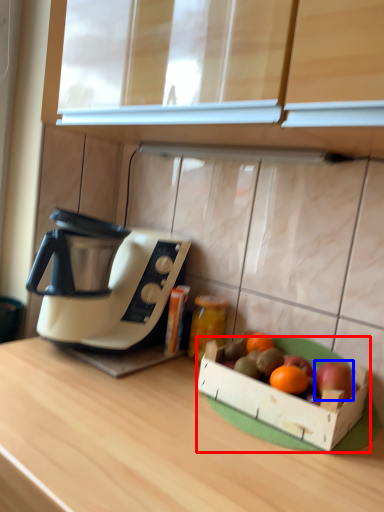
Question: Which object appears farthest to the camera in this image, cardboard box (highlighted by a red box) or apple (highlighted by a blue box)?

Choices:
 (A) cardboard box
 (B) apple

Answer: (B)